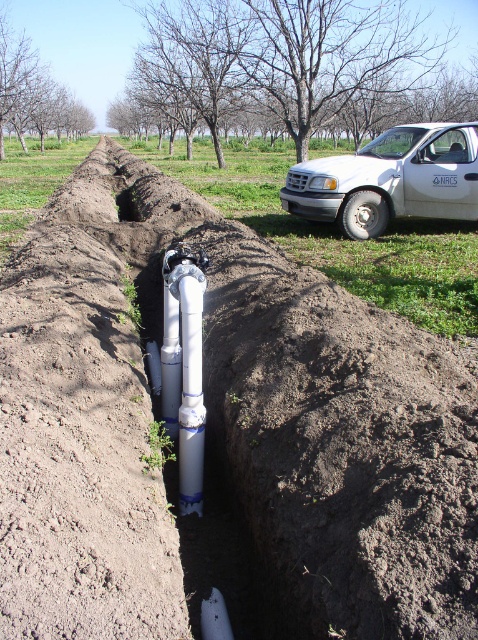
You are a construction worker who needs to transport the white plastic water pipe at center to the white matte truck at upper right. Can you lift the pipe and carry it directly to the truck without bending over?

The white matte truck at upper right is taller than the white plastic water pipe at center. Since the truck is taller, the pipe can be carried directly without needing to bend over as there is enough vertical clearance.

You are a surveyor standing at the center of the trench. You need to locate the white matte truck at upper right. According to the coordinates provided, in which direction should you look to find it?

The white matte truck at upper right is located at coordinates point [391,179]. Since you are at the center of the trench, you should look towards the upper right direction to find it.